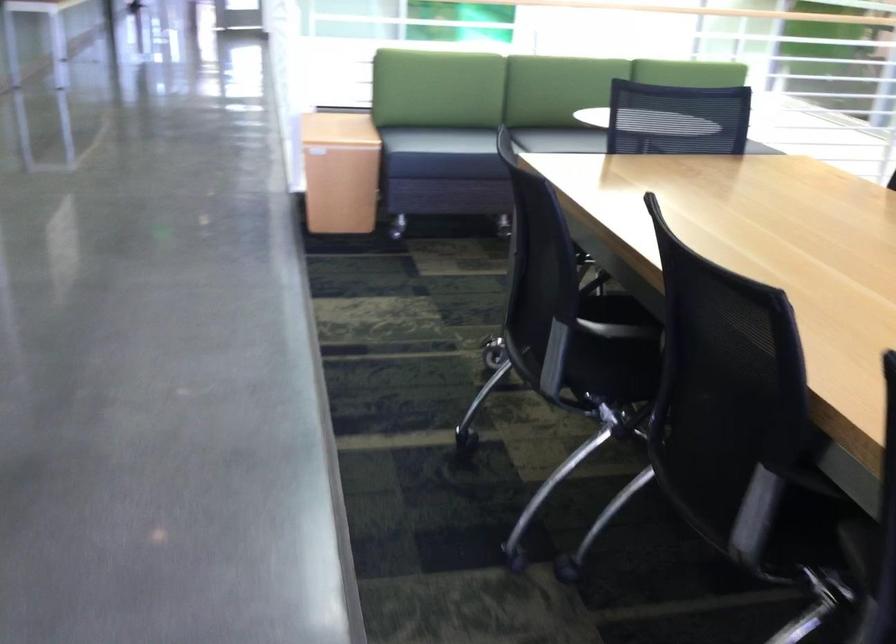
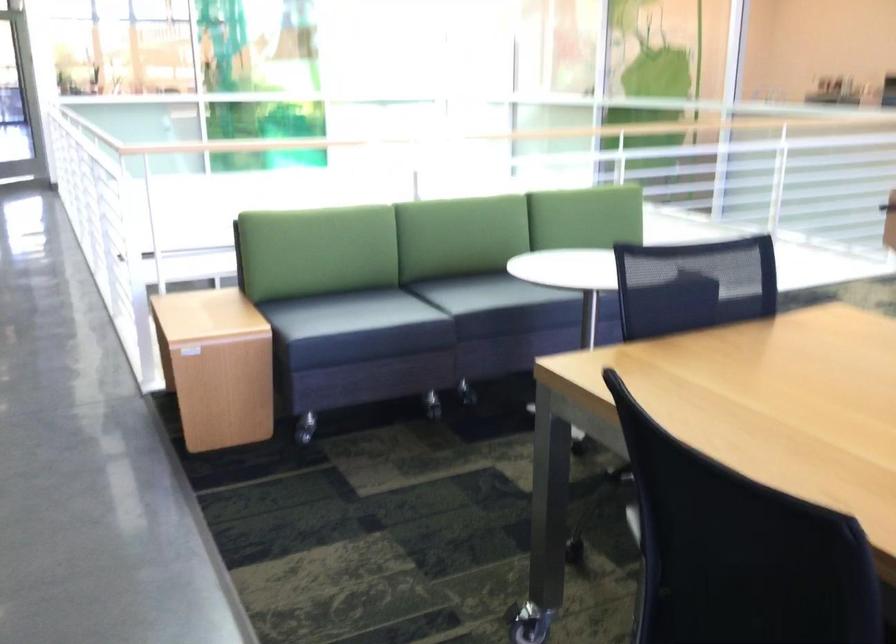
Question: The images are taken continuously from a first-person perspective. In which direction is your viewpoint rotating?

Choices:
 (A) Left
 (B) Right
 (C) Up
 (D) Down

Answer: (B)